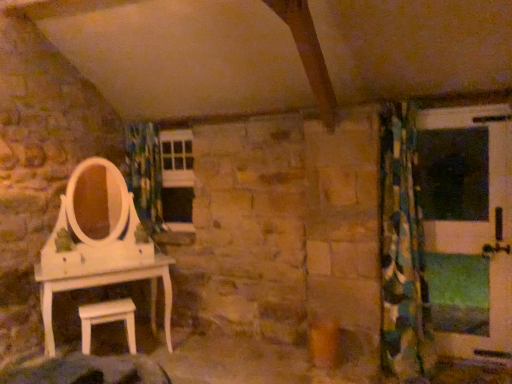
At what (x,y) coordinates should I click in order to perform the action: click on green matte screen door at right. Please return your answer as a coordinate pair (x, y). The height and width of the screenshot is (384, 512). Looking at the image, I should click on (468, 227).

From the image's perspective, between green matte screen door at right and blue-green patterned fabric at center, who is located below?

green matte screen door at right appears lower in the image.

Is point (477, 178) closer to camera compared to point (129, 132)?

Yes, point (477, 178) is in front of point (129, 132).

Is green matte screen door at right positioned with its back to blue-green patterned fabric at center?

No, green matte screen door at right is not facing away from blue-green patterned fabric at center.

Are green matte screen door at right and blue-green patterned fabric at center making contact?

No, green matte screen door at right is not in contact with blue-green patterned fabric at center.

Does white matte stool at lower left appear on the left side of green matte screen door at right?

Yes.

Between point (134, 337) and point (506, 240), which one is positioned behind?

The point (134, 337) is more distant.

Where is `screen door above the white matte stool at lower left (from the image's perspective)`? The height and width of the screenshot is (384, 512). screen door above the white matte stool at lower left (from the image's perspective) is located at coordinates (468, 227).

What's the angular difference between white matte stool at lower left and green matte screen door at right's facing directions?

48.2 degrees separate the facing orientations of white matte stool at lower left and green matte screen door at right.

Is the depth of blue-green patterned fabric at center greater than that of green and blue patterned curtain at right?

Yes.

Would you say blue-green patterned fabric at center is a long distance from green and blue patterned curtain at right?

Yes, blue-green patterned fabric at center is far from green and blue patterned curtain at right.

Is blue-green patterned fabric at center bigger or smaller than green and blue patterned curtain at right?

In the image, blue-green patterned fabric at center appears to be smaller than green and blue patterned curtain at right.

Consider the image. From a real-world perspective, does blue-green patterned fabric at center sit lower than green and blue patterned curtain at right?

No, from a real-world perspective, blue-green patterned fabric at center is not beneath green and blue patterned curtain at right.

Based on their sizes in the image, would you say white matte stool at lower left is bigger or smaller than green and blue patterned curtain at right?

Considering their sizes, white matte stool at lower left takes up less space than green and blue patterned curtain at right.

Choose the correct answer: Is white matte stool at lower left inside green and blue patterned curtain at right or outside it?

white matte stool at lower left is not enclosed by green and blue patterned curtain at right.

Is white matte stool at lower left at the left side of green and blue patterned curtain at right?

Yes.

Does point (90, 307) come behind point (386, 278)?

No, (90, 307) is closer to viewer.

Which object is positioned more to the left, green matte screen door at right or green and blue patterned curtain at right?

Positioned to the left is green and blue patterned curtain at right.

This screenshot has width=512, height=384. What are the coordinates of `curtain in front of the green matte screen door at right` in the screenshot? It's located at (402, 251).

Can you tell me how much green matte screen door at right and green and blue patterned curtain at right differ in facing direction?

green matte screen door at right and green and blue patterned curtain at right are facing 0.632 degrees away from each other.

In order to click on curtain that is in front of the green matte screen door at right in this screenshot , I will do `click(402, 251)`.

Who is more distant, green and blue patterned curtain at right or green matte screen door at right?

Positioned behind is green matte screen door at right.

Between green and blue patterned curtain at right and green matte screen door at right, which one has more height?

Standing taller between the two is green and blue patterned curtain at right.

What's the angular difference between green and blue patterned curtain at right and green matte screen door at right's facing directions?

There is a 0.632-degree angle between the facing directions of green and blue patterned curtain at right and green matte screen door at right.

Is green and blue patterned curtain at right next to white matte stool at lower left?

No, green and blue patterned curtain at right is not beside white matte stool at lower left.

From the image's perspective, which one is positioned lower, green and blue patterned curtain at right or white matte stool at lower left?

white matte stool at lower left, from the image's perspective.

Is green and blue patterned curtain at right closer to the viewer compared to white matte stool at lower left?

Yes, the depth of green and blue patterned curtain at right is less than that of white matte stool at lower left.

You are a GUI agent. You are given a task and a screenshot of the screen. Output one action in this format:
    pyautogui.click(x=<x>, y=<y>)
    Task: Click on the furniture on the left of green and blue patterned curtain at right
    Image resolution: width=512 pixels, height=384 pixels.
    Given the screenshot: What is the action you would take?
    pyautogui.click(x=108, y=320)

Find the location of `shower curtain on the left of green matte screen door at right`. shower curtain on the left of green matte screen door at right is located at coordinates (144, 172).

I want to click on screen door above the white matte stool at lower left (from a real-world perspective), so click(468, 227).

Which object lies nearer to the anchor point green matte screen door at right, white matte stool at lower left or blue-green patterned fabric at center?

white matte stool at lower left is closer to green matte screen door at right.

Considering their positions, is blue-green patterned fabric at center positioned further to white matte stool at lower left than green and blue patterned curtain at right?

Among the two, green and blue patterned curtain at right is located further to white matte stool at lower left.

From the image, which object appears to be nearer to green matte screen door at right, blue-green patterned fabric at center or green and blue patterned curtain at right?

Based on the image, green and blue patterned curtain at right appears to be nearer to green matte screen door at right.

In the scene shown: Estimate the real-world distances between objects in this image. Which object is closer to green and blue patterned curtain at right, green matte screen door at right or blue-green patterned fabric at center?

green matte screen door at right is positioned closer to the anchor green and blue patterned curtain at right.

Which object lies further to the anchor point blue-green patterned fabric at center, white matte stool at lower left or green and blue patterned curtain at right?

green and blue patterned curtain at right lies further to blue-green patterned fabric at center than the other object.

Based on their spatial positions, is green matte screen door at right or white matte stool at lower left closer to blue-green patterned fabric at center?

white matte stool at lower left.

Estimate the real-world distances between objects in this image. Which object is closer to blue-green patterned fabric at center, white matte stool at lower left or green matte screen door at right?

Based on the image, white matte stool at lower left appears to be nearer to blue-green patterned fabric at center.

When comparing their distances from green matte screen door at right, does green and blue patterned curtain at right or blue-green patterned fabric at center seem closer?

green and blue patterned curtain at right is closer to green matte screen door at right.

You are a GUI agent. You are given a task and a screenshot of the screen. Output one action in this format:
    pyautogui.click(x=<x>, y=<y>)
    Task: Click on the curtain situated between blue-green patterned fabric at center and green matte screen door at right from left to right
    Image resolution: width=512 pixels, height=384 pixels.
    Given the screenshot: What is the action you would take?
    pyautogui.click(x=402, y=251)

Where is `furniture between blue-green patterned fabric at center and green matte screen door at right from left to right`? The image size is (512, 384). furniture between blue-green patterned fabric at center and green matte screen door at right from left to right is located at coordinates (108, 320).

Locate an element on the screen. The image size is (512, 384). curtain between white matte stool at lower left and green matte screen door at right in the horizontal direction is located at coordinates (402, 251).

Identify the location of furniture between blue-green patterned fabric at center and green and blue patterned curtain at right in the horizontal direction. (108, 320).